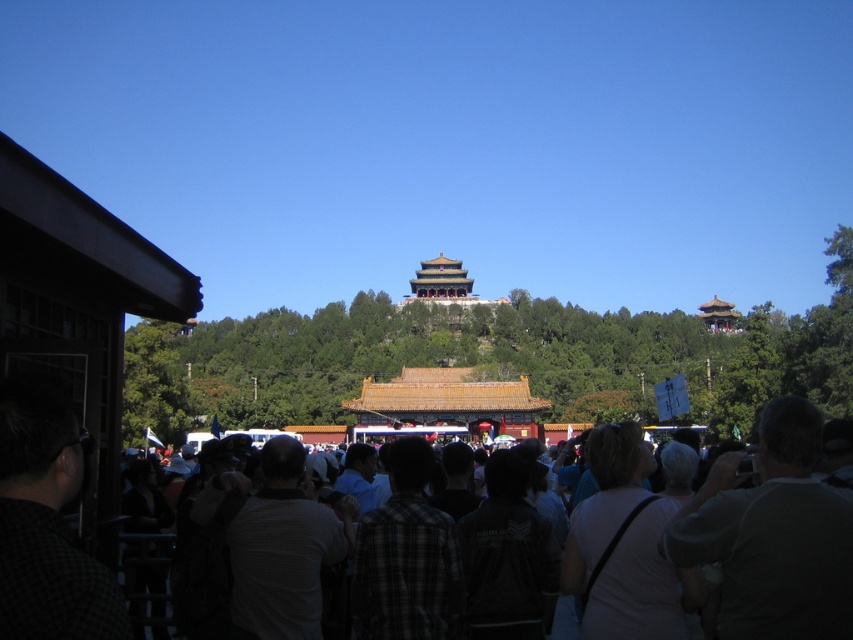
You are a photographer trying to capture a photo of the pagoda in the background. You notice two tourists wearing a white checkered shirt at center and a dark plaid shirt at center. Which tourist is wider in the frame to potentially block your view of the pagoda?

The white checkered shirt at center is wider than the dark plaid shirt at center, so the tourist wearing the white checkered shirt at center is wider and might block the view of the pagoda more.

You are standing in the crowd at the historical site and want to take a photo of both the point at coordinates (851, 612) and the point at (28, 472). Which point should you focus on first to ensure both are in the frame?

You should focus on point (851, 612) first because it is closer to the camera than point (28, 472), ensuring both points are within the frame.